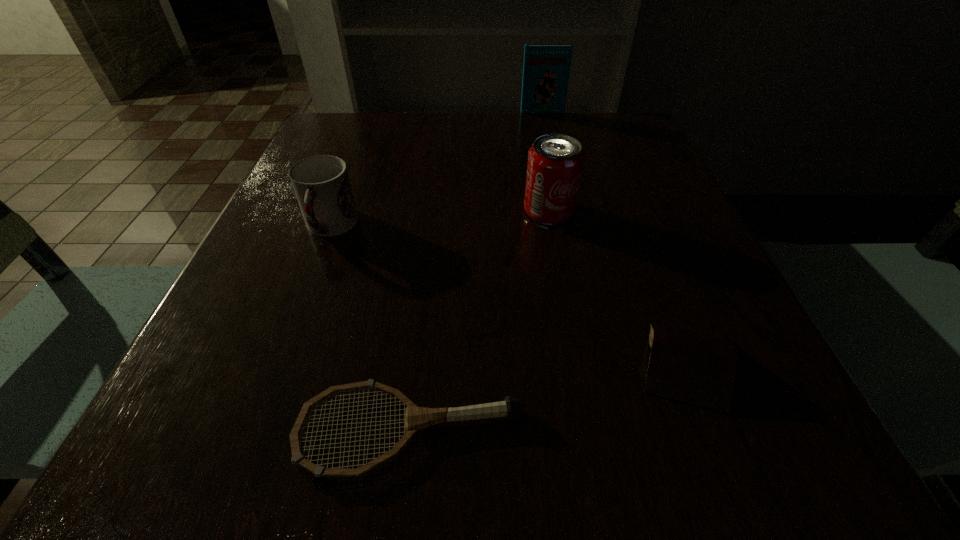
The width and height of the screenshot is (960, 540). Find the location of `blank area located 0.310m on the front of the fourth shortest object`. blank area located 0.310m on the front of the fourth shortest object is located at coordinates (579, 373).

Identify the location of blank space located 0.210m on the side of the third shortest object where the handle is located. The height and width of the screenshot is (540, 960). pyautogui.click(x=282, y=353).

Find the location of a particular element. This screenshot has width=960, height=540. free region located 0.080m on the front of the shorter book is located at coordinates (731, 481).

Identify the location of free space located 0.220m on the right of the shortest object. Image resolution: width=960 pixels, height=540 pixels. (704, 430).

Where is `object that is at the far edge`? Image resolution: width=960 pixels, height=540 pixels. object that is at the far edge is located at coordinates (546, 69).

Identify the location of book that is positioned at the near edge. (688, 364).

This screenshot has width=960, height=540. I want to click on tennis racket located at the near edge, so (x=416, y=418).

Locate an element on the screen. This screenshot has height=540, width=960. object positioned at the left edge is located at coordinates (321, 183).

Identify the location of object that is at the right edge. (688, 364).

Locate an element on the screen. Image resolution: width=960 pixels, height=540 pixels. object that is at the near right corner is located at coordinates (688, 364).